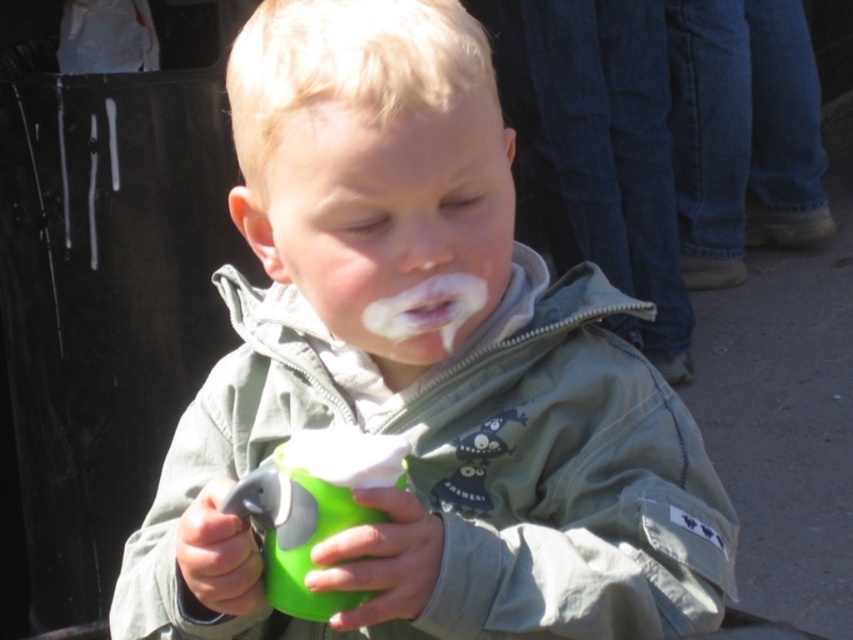
Measure the distance between point (x=271, y=481) and camera.

Point (x=271, y=481) and camera are 24.12 inches apart from each other.

Who is taller, green rubber cup at center or smooth flesh nose at center?

green rubber cup at center is taller.

Between point (264, 547) and point (430, 241), which one is positioned behind?

Positioned behind is point (264, 547).

Identify the location of green rubber cup at center. (314, 508).

Is smooth flesh nose at center smaller than white matte mouth at center?

No.

Is point (396, 224) positioned before point (408, 294)?

That is True.

I want to click on smooth flesh nose at center, so click(421, 241).

Is green matte cup at center wider than white matte frosting at mouth center?

Answer: Yes.

Does point (340, 90) lie behind point (379, 324)?

No, (340, 90) is closer to viewer.

Find the location of a particular element. The height and width of the screenshot is (640, 853). green matte cup at center is located at coordinates (422, 372).